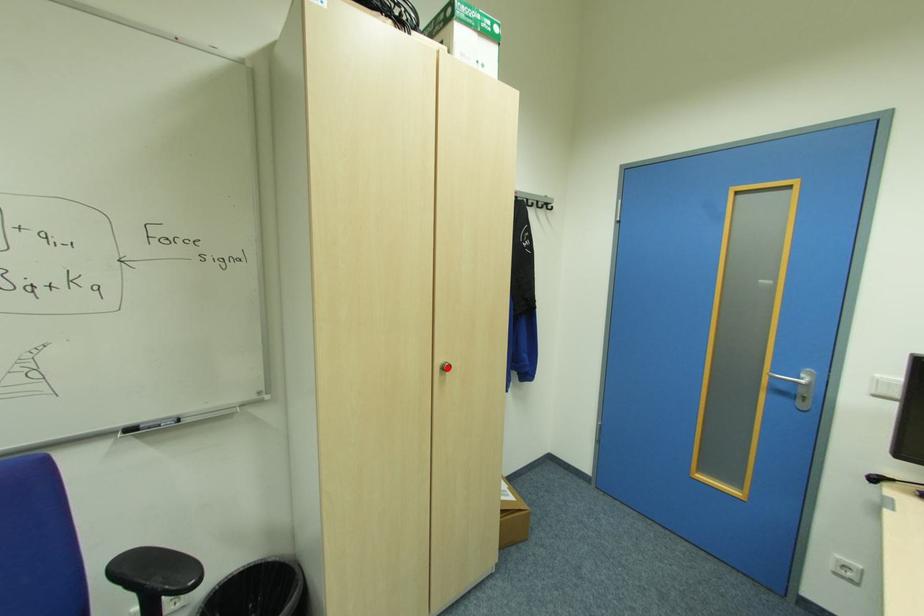
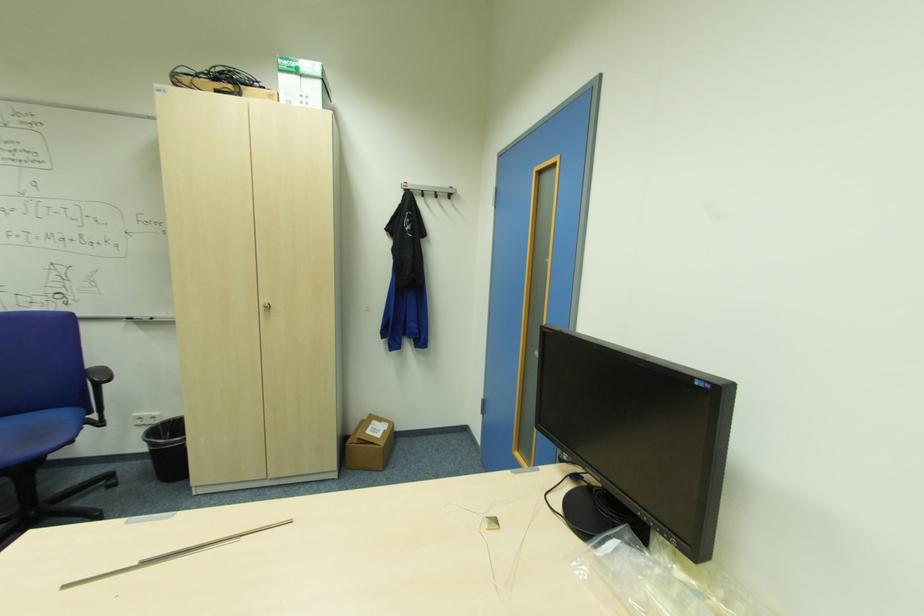
In the second image, find the point that corresponds to the highlighted location in the first image.

(271, 307)